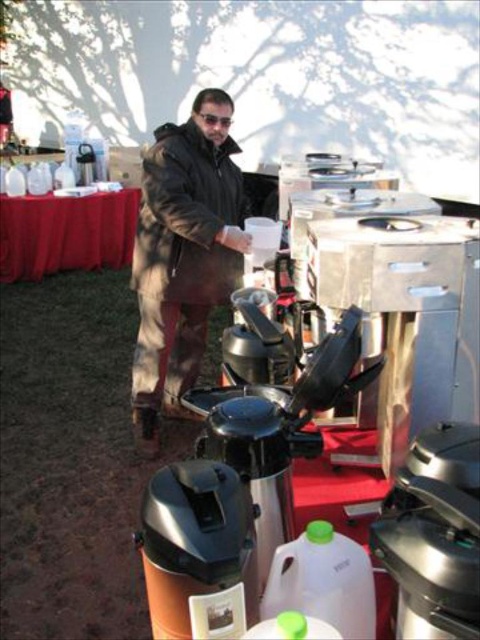
Question: Is stainless steel coffee maker at center below brushed metal coffee pot at center?

Choices:
 (A) yes
 (B) no

Answer: (B)

Question: Considering the relative positions of stainless steel coffee maker at center and black leather jacket at center in the image provided, where is stainless steel coffee maker at center located with respect to black leather jacket at center?

Choices:
 (A) right
 (B) left

Answer: (A)

Question: Is stainless steel coffee maker at center thinner than red satin tablecloth at left?

Choices:
 (A) no
 (B) yes

Answer: (B)

Question: Which of the following is the farthest from the observer?

Choices:
 (A) stainless steel coffee maker at center
 (B) orange matte thermos at center
 (C) red satin tablecloth at left
 (D) brushed metal coffee pot at center

Answer: (C)

Question: Among these points, which one is farthest from the camera?

Choices:
 (A) (247, 248)
 (B) (328, 253)
 (C) (132, 234)
 (D) (450, 442)

Answer: (C)

Question: Which object is positioned farthest from the black leather jacket at center?

Choices:
 (A) brushed metal coffee pot at center
 (B) red satin tablecloth at left
 (C) stainless steel coffee maker at center

Answer: (B)